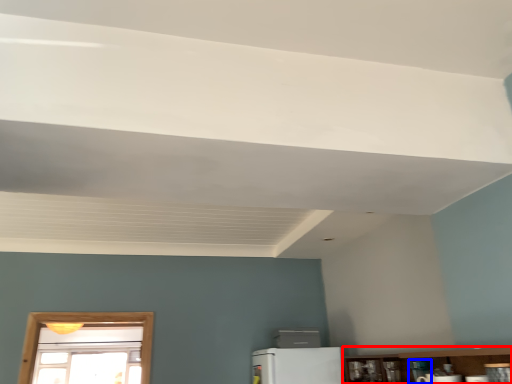
Question: Among these objects, which one is farthest to the camera, shelf (highlighted by a red box) or appliance (highlighted by a blue box)?

Choices:
 (A) shelf
 (B) appliance

Answer: (B)